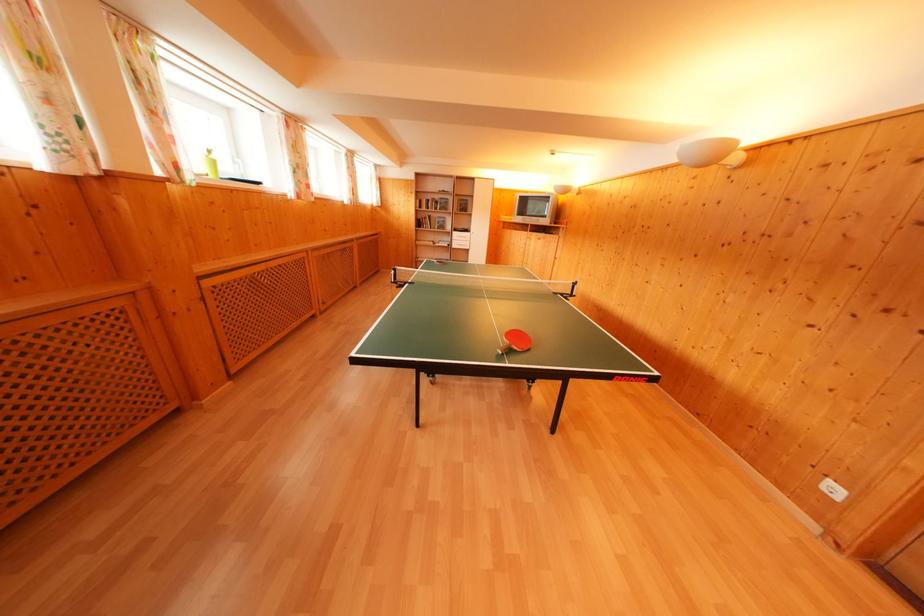
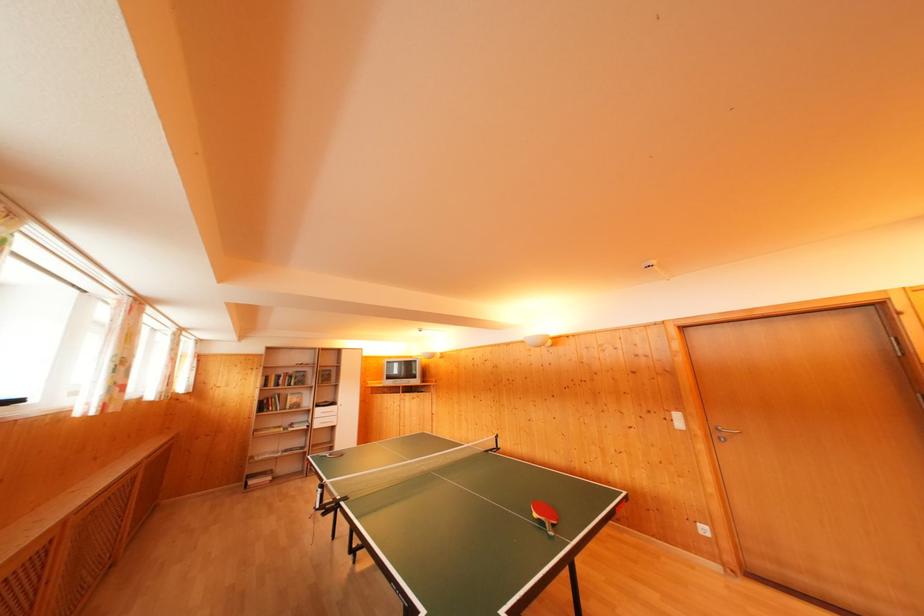
The point at (442, 203) is marked in the first image. Where is the corresponding point in the second image?

(296, 376)